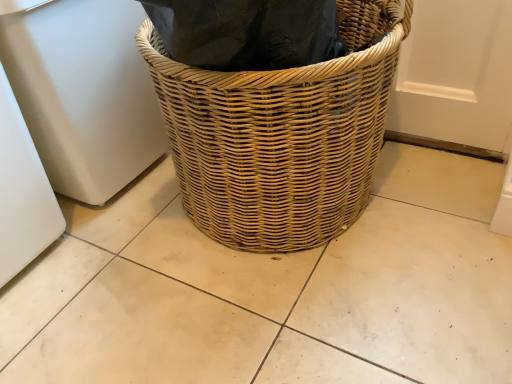
What are the coordinates of `white matte refrigerator at left` in the screenshot? It's located at (84, 93).

This screenshot has width=512, height=384. Describe the element at coordinates (84, 93) in the screenshot. I see `white matte refrigerator at left` at that location.

In order to face natural woven basket at center, should I rotate leftwards or rightwards?

Turn right by 1.308 degrees to look at natural woven basket at center.

This screenshot has width=512, height=384. In order to click on natural woven basket at center in this screenshot , I will do `click(282, 134)`.

What do you see at coordinates (282, 134) in the screenshot? This screenshot has height=384, width=512. I see `natural woven basket at center` at bounding box center [282, 134].

Locate an element on the screen. This screenshot has height=384, width=512. white matte refrigerator at left is located at coordinates (84, 93).

Considering the positions of objects white matte refrigerator at left and natural woven basket at center in the image provided, who is more to the left, white matte refrigerator at left or natural woven basket at center?

white matte refrigerator at left.

Which object is further away from the camera, white matte refrigerator at left or natural woven basket at center?

white matte refrigerator at left.

Is point (134, 8) behind point (303, 243)?

Yes, it is.

From the image's perspective, relative to natural woven basket at center, is white matte refrigerator at left above or below?

Based on their image positions, white matte refrigerator at left is located above natural woven basket at center.

In the scene shown: From a real-world perspective, relative to natural woven basket at center, is white matte refrigerator at left vertically above or below?

Clearly, from a real-world perspective, white matte refrigerator at left is above natural woven basket at center.

Considering the sizes of objects white matte refrigerator at left and natural woven basket at center in the image provided, who is wider, white matte refrigerator at left or natural woven basket at center?

With larger width is natural woven basket at center.

Is white matte refrigerator at left taller than natural woven basket at center?

Indeed, white matte refrigerator at left has a greater height compared to natural woven basket at center.

Who is smaller, white matte refrigerator at left or natural woven basket at center?

white matte refrigerator at left.

From the picture: Is natural woven basket at center inside white matte refrigerator at left?

No, natural woven basket at center is located outside of white matte refrigerator at left.

Is white matte refrigerator at left next to natural woven basket at center and touching it?

white matte refrigerator at left and natural woven basket at center are clearly separated.

Is white matte refrigerator at left oriented away from natural woven basket at center?

No, white matte refrigerator at left is not facing the opposite direction of natural woven basket at center.

Locate an element on the screen. picnic basket below the white matte refrigerator at left (from the image's perspective) is located at coordinates (282, 134).

In the image, is natural woven basket at center on the left side or the right side of white matte refrigerator at left?

From the image, it's evident that natural woven basket at center is to the right of white matte refrigerator at left.

From the picture: Which is behind, natural woven basket at center or white matte refrigerator at left?

→ Positioned behind is white matte refrigerator at left.

Which point is more forward, (333, 81) or (36, 113)?

Positioned in front is point (333, 81).

From the image's perspective, is natural woven basket at center positioned above or below white matte refrigerator at left?

natural woven basket at center is situated lower than white matte refrigerator at left in the image.

From a real-world perspective, between natural woven basket at center and white matte refrigerator at left, who is vertically lower?

From a 3D spatial view, natural woven basket at center is below.

Is natural woven basket at center wider or thinner than white matte refrigerator at left?

Clearly, natural woven basket at center has more width compared to white matte refrigerator at left.

Does natural woven basket at center have a lesser height compared to white matte refrigerator at left?

Indeed, natural woven basket at center has a lesser height compared to white matte refrigerator at left.

Considering the relative sizes of natural woven basket at center and white matte refrigerator at left in the image provided, is natural woven basket at center bigger than white matte refrigerator at left?

Yes.

In the scene shown: Is natural woven basket at center spatially inside white matte refrigerator at left, or outside of it?

natural woven basket at center is not enclosed by white matte refrigerator at left.

Consider the image. Is natural woven basket at center touching white matte refrigerator at left?

No.

Is natural woven basket at center aimed at white matte refrigerator at left?

No, natural woven basket at center is not aimed at white matte refrigerator at left.

Can you tell me how much natural woven basket at center and white matte refrigerator at left differ in facing direction?

The facing directions of natural woven basket at center and white matte refrigerator at left are 90.9 degrees apart.

Measure the distance between natural woven basket at center and white matte refrigerator at left.

13.38 inches.

In order to click on picnic basket directly beneath the white matte refrigerator at left (from a real-world perspective) in this screenshot , I will do `click(282, 134)`.

In order to click on picnic basket that appears below the white matte refrigerator at left (from the image's perspective) in this screenshot , I will do `click(282, 134)`.

The height and width of the screenshot is (384, 512). What are the coordinates of `appliance above the natural woven basket at center (from the image's perspective)` in the screenshot? It's located at (84, 93).